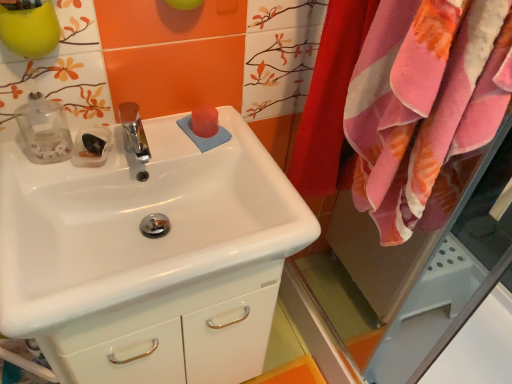
Question: From a real-world perspective, relative to pink soft towel at right, is white glossy sink at center vertically above or below?

Choices:
 (A) below
 (B) above

Answer: (A)

Question: Considering their positions, is white glossy sink at center located in front of or behind pink soft towel at right?

Choices:
 (A) behind
 (B) front

Answer: (A)

Question: Estimate the real-world distances between objects in this image. Which object is closer to the pink plush towel at right?

Choices:
 (A) pink soft towel at right
 (B) white glossy sink at center

Answer: (A)

Question: Which object is positioned closest to the pink plush towel at right?

Choices:
 (A) pink soft towel at right
 (B) white glossy sink at center

Answer: (A)